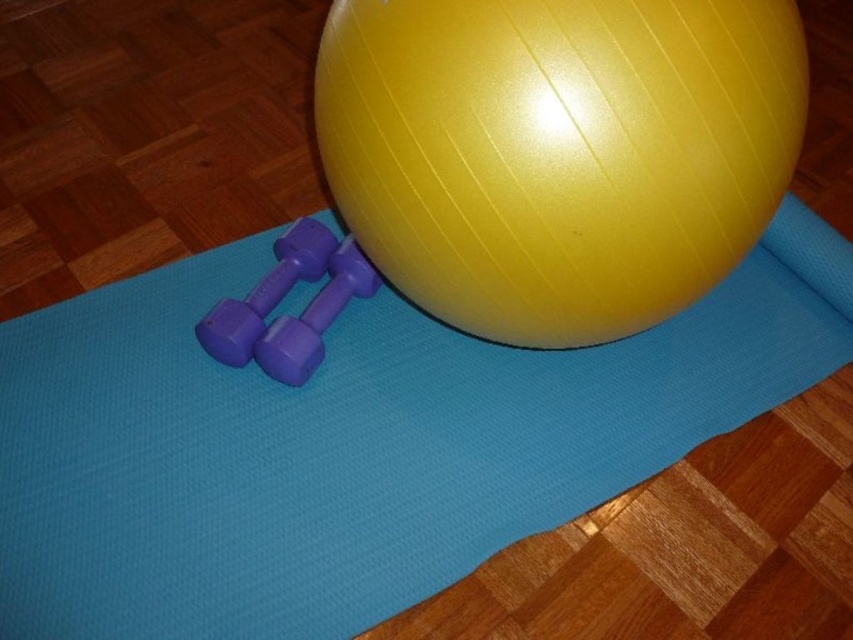
Is point (259, 330) positioned before point (283, 358)?

That is False.

Can you confirm if purple rubber dumbbell at left is positioned below purple rubber dumbbells at center?

Incorrect, purple rubber dumbbell at left is not positioned below purple rubber dumbbells at center.

Identify the location of purple rubber dumbbell at left. The image size is (853, 640). (265, 292).

In the scene shown: Can you confirm if blue rubber yoga mat at center is positioned below purple rubber dumbbell at left?

Yes.

Is point (161, 552) farther from viewer compared to point (254, 316)?

No.

What do you see at coordinates (351, 442) in the screenshot? Image resolution: width=853 pixels, height=640 pixels. I see `blue rubber yoga mat at center` at bounding box center [351, 442].

Identify the location of blue rubber yoga mat at center. 351,442.

Can you confirm if blue rubber yoga mat at center is thinner than glossy yellow ball at center?

In fact, blue rubber yoga mat at center might be wider than glossy yellow ball at center.

How distant is blue rubber yoga mat at center from glossy yellow ball at center?

A distance of 17.27 inches exists between blue rubber yoga mat at center and glossy yellow ball at center.

Does point (223, 522) lie behind point (397, 28)?

Yes, it is behind point (397, 28).

Identify the location of blue rubber yoga mat at center. This screenshot has width=853, height=640. (351, 442).